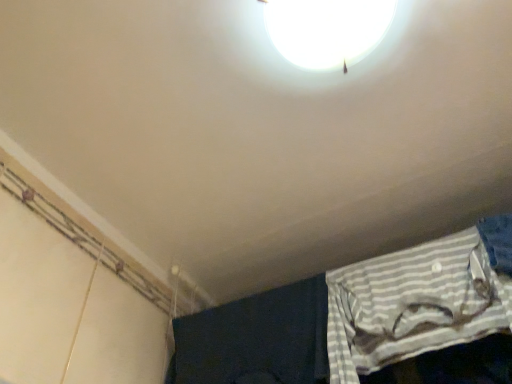
Question: Is white striped fabric at lower right shorter than white glossy lamp at upper center?

Choices:
 (A) yes
 (B) no

Answer: (B)

Question: Is white striped fabric at lower right positioned far away from white glossy lamp at upper center?

Choices:
 (A) no
 (B) yes

Answer: (A)

Question: Is white striped fabric at lower right at the right side of white glossy lamp at upper center?

Choices:
 (A) no
 (B) yes

Answer: (B)

Question: Is white striped fabric at lower right facing towards white glossy lamp at upper center?

Choices:
 (A) no
 (B) yes

Answer: (B)

Question: Does white striped fabric at lower right have a lesser width compared to white glossy lamp at upper center?

Choices:
 (A) yes
 (B) no

Answer: (A)

Question: Is white striped fabric at lower right positioned with its back to white glossy lamp at upper center?

Choices:
 (A) yes
 (B) no

Answer: (B)

Question: Does white glossy lamp at upper center have a greater width compared to white striped fabric at lower right?

Choices:
 (A) yes
 (B) no

Answer: (A)

Question: Is white glossy lamp at upper center in front of white striped fabric at lower right?

Choices:
 (A) yes
 (B) no

Answer: (A)

Question: From a real-world perspective, is white glossy lamp at upper center positioned under white striped fabric at lower right based on gravity?

Choices:
 (A) no
 (B) yes

Answer: (A)

Question: Is white glossy lamp at upper center oriented away from white striped fabric at lower right?

Choices:
 (A) no
 (B) yes

Answer: (A)

Question: Is white glossy lamp at upper center thinner than white striped fabric at lower right?

Choices:
 (A) no
 (B) yes

Answer: (A)

Question: Are white glossy lamp at upper center and white striped fabric at lower right located far from each other?

Choices:
 (A) yes
 (B) no

Answer: (B)

Question: Visually, is white glossy lamp at upper center positioned to the left or to the right of white striped fabric at lower right?

Choices:
 (A) left
 (B) right

Answer: (A)